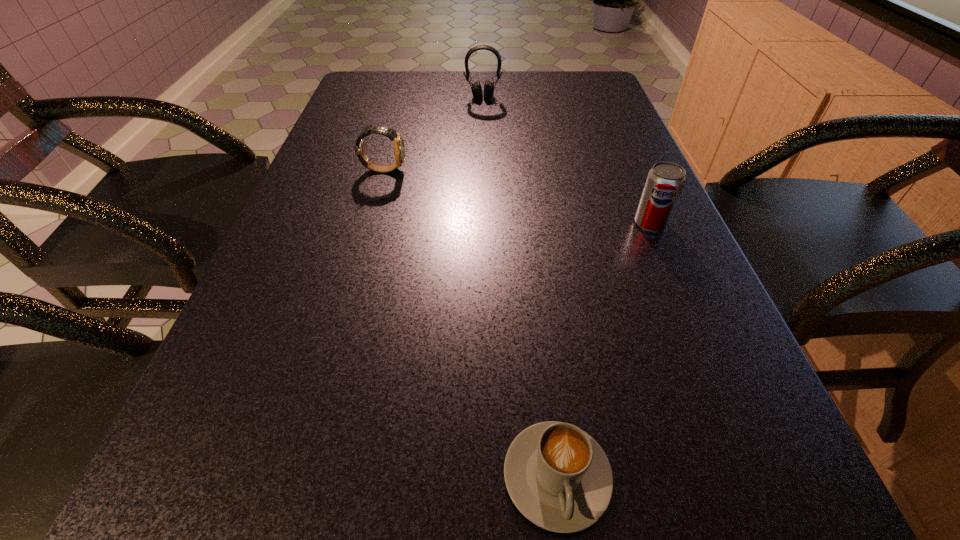
Locate an element on the screen. The height and width of the screenshot is (540, 960). vacant space that's between the soda and the headset is located at coordinates (566, 160).

This screenshot has width=960, height=540. What are the coordinates of `vacant space in between the shortest object and the third farthest object` in the screenshot? It's located at (604, 350).

Locate an element on the screen. The height and width of the screenshot is (540, 960). unoccupied position between the shortest object and the second nearest object is located at coordinates (604, 350).

At what (x,y) coordinates should I click in order to perform the action: click on free spot between the third farthest object and the headset. Please return your answer as a coordinate pair (x, y). The width and height of the screenshot is (960, 540). Looking at the image, I should click on pyautogui.click(x=566, y=160).

What are the coordinates of `free spot between the shortest object and the farthest object` in the screenshot? It's located at (520, 286).

You are a GUI agent. You are given a task and a screenshot of the screen. Output one action in this format:
    pyautogui.click(x=<x>, y=<y>)
    Task: Click on the free spot between the second nearest object and the farthest object
    Image resolution: width=960 pixels, height=540 pixels.
    Given the screenshot: What is the action you would take?
    pyautogui.click(x=566, y=160)

Find the location of a particular element. Image resolution: width=960 pixels, height=540 pixels. vacant area that lies between the nearest object and the second shortest object is located at coordinates (470, 323).

Find the location of `the closest object to the watch`. the closest object to the watch is located at coordinates (476, 88).

Identify the location of object identified as the closest to the cappuccino. (665, 181).

Locate an element on the screen. blank space that satisfies the following two spatial constraints: 1. on the face of the second shortest object; 2. on the left side of the rightmost object is located at coordinates (368, 224).